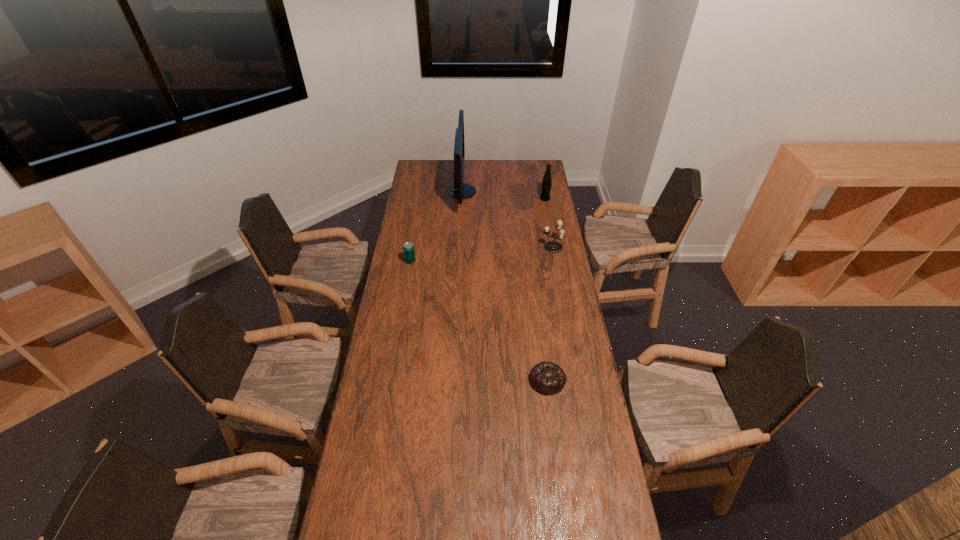
This screenshot has height=540, width=960. In order to click on the tallest object in this screenshot , I will do `click(460, 190)`.

I want to click on the second object from left to right, so click(x=460, y=190).

I want to click on beer bottle, so click(x=546, y=185).

At what (x,y) coordinates should I click in order to perform the action: click on candle holder. Please return your answer as a coordinate pair (x, y). Image resolution: width=960 pixels, height=540 pixels. Looking at the image, I should click on (551, 246).

At what (x,y) coordinates should I click in order to perform the action: click on the third farthest object. Please return your answer as a coordinate pair (x, y). The height and width of the screenshot is (540, 960). Looking at the image, I should click on (551, 246).

Find the location of `the fourth tallest object`. the fourth tallest object is located at coordinates (409, 254).

This screenshot has height=540, width=960. In order to click on the leftmost object in this screenshot , I will do `click(409, 254)`.

Where is `beanbag`? This screenshot has width=960, height=540. beanbag is located at coordinates (548, 378).

At what (x,y) coordinates should I click in order to perform the action: click on the shortest object. Please return your answer as a coordinate pair (x, y). The height and width of the screenshot is (540, 960). Looking at the image, I should click on (548, 378).

Find the location of a particular element. The height and width of the screenshot is (540, 960). vacant region located on the front-facing side of the fourth object from right to left is located at coordinates (547, 192).